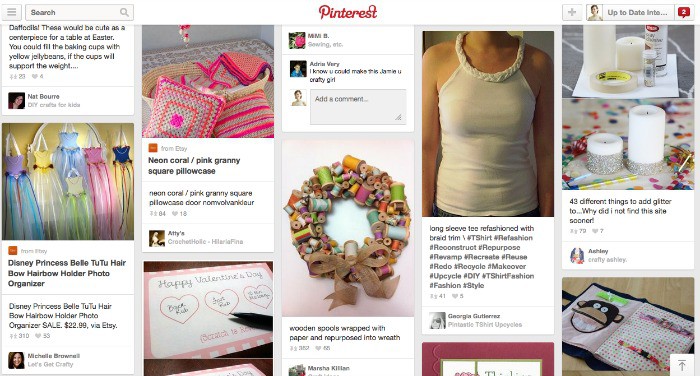
At what (x,y) coordinates should I click in order to perform the action: click on candles. Please return your answer as a coordinate pair (x, y). Image resolution: width=700 pixels, height=376 pixels. Looking at the image, I should click on coord(642,142), coord(603,142), coord(593,47), coord(628,55).